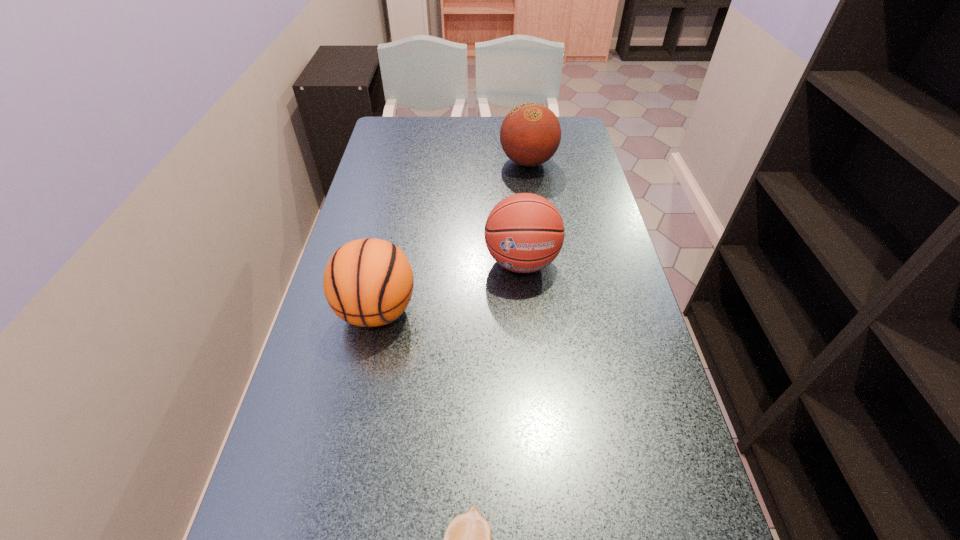
In the image, there is a desktop. Where is `vacant space at the right edge`? vacant space at the right edge is located at coordinates (609, 312).

The image size is (960, 540). What are the coordinates of `free space at the far left corner of the desktop` in the screenshot? It's located at (398, 120).

Locate an element on the screen. The width and height of the screenshot is (960, 540). free area in between the leftmost basketball and the farthest basketball is located at coordinates (452, 237).

Locate an element on the screen. free point between the leftmost object and the farthest object is located at coordinates [x=452, y=237].

Where is `object that is the nearest to the shortest object`? The height and width of the screenshot is (540, 960). object that is the nearest to the shortest object is located at coordinates (369, 282).

You are a GUI agent. You are given a task and a screenshot of the screen. Output one action in this format:
    pyautogui.click(x=<x>, y=<y>)
    Task: Click on the object that is the third closest one to the farthest object
    This screenshot has height=540, width=960.
    Given the screenshot: What is the action you would take?
    pyautogui.click(x=467, y=539)

This screenshot has height=540, width=960. Find the location of `the second closest basketball to the shortest object`. the second closest basketball to the shortest object is located at coordinates (524, 233).

I want to click on basketball that is the closest one to the farthest object, so click(x=524, y=233).

I want to click on vacant area in the image that satisfies the following two spatial constraints: 1. on the back side of the farthest basketball; 2. on the left side of the leftmost object, so click(x=408, y=162).

Image resolution: width=960 pixels, height=540 pixels. In order to click on vacant space that satisfies the following two spatial constraints: 1. on the back side of the leftmost object; 2. on the left side of the farthest object in this screenshot , I will do `click(408, 162)`.